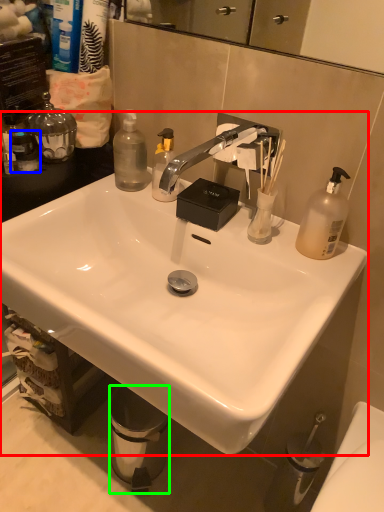
Question: Which is farther away from sink (highlighted by a red box)? toiletry (highlighted by a blue box) or trash bin/can (highlighted by a green box)?

Choices:
 (A) toiletry
 (B) trash bin/can

Answer: (B)